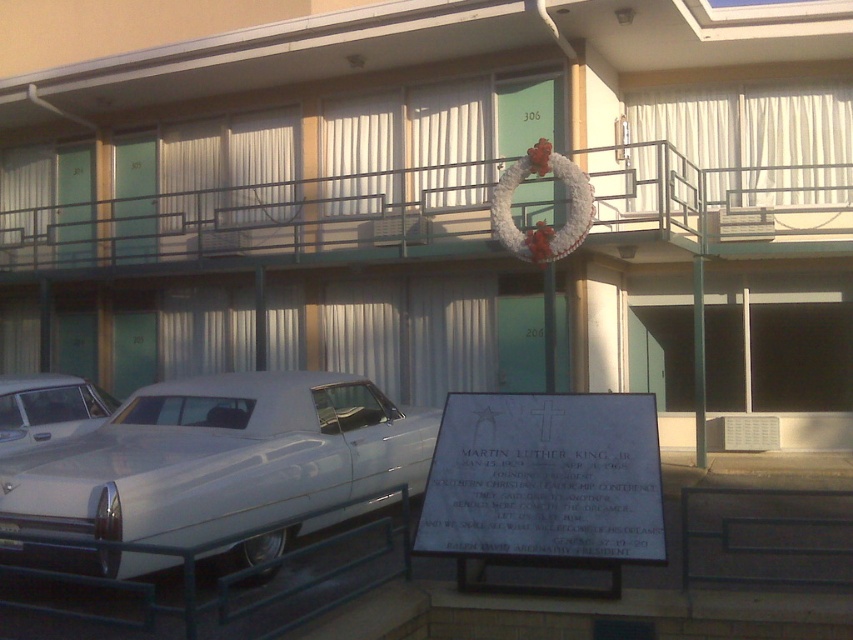
You are standing at the entrance of the motel and want to walk to the point marked by point (x=807, y=243). Which direction should you go relative to point (x=329, y=467)?

You should walk behind point (x=329, y=467) to reach point (x=807, y=243) because the point (x=807, y=243) is located behind point (x=329, y=467).

You are a delivery person trying to park your truck next to the motel entrance. You see the white glossy car at lower left and the white glossy sedan at lower left. Which vehicle should you move to make space for your truck?

You should move the white glossy car at lower left because it is bigger than the white glossy sedan at lower left, so removing the larger vehicle would free up more space for the truck.

You are standing at the entrance of the motel and want to take a photo of both the metallic green balcony at upper center and the white glossy car at lower left. Which object should you focus on first to ensure both are in focus?

You should focus on the metallic green balcony at upper center first because it is closer to you than the white glossy car at lower left, so adjusting focus from near to far will help both be in focus.